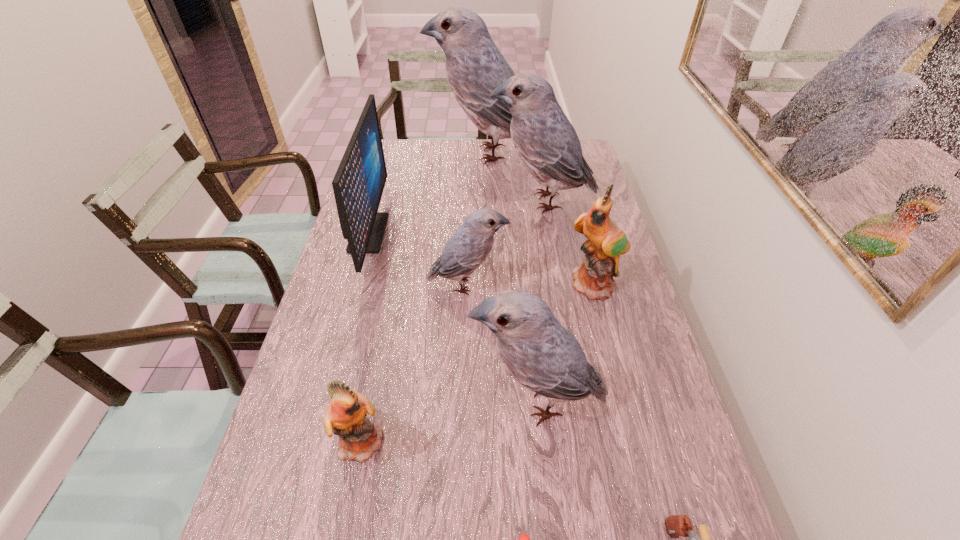
Identify which parrot is the sixth nearest to the leftmost object. Please provide its 2D coordinates. Your answer should be formatted as a tuple, i.e. [(x, y)], where the tuple contains the x and y coordinates of a point satisfying the conditions above.

[(606, 241)]

Locate which gray parrot is the fourth closest to the gun. Please provide its 2D coordinates. Your answer should be formatted as a tuple, i.e. [(x, y)], where the tuple contains the x and y coordinates of a point satisfying the conditions above.

[(474, 66)]

Locate an element on the screen. This screenshot has height=540, width=960. gray parrot identified as the third closest to the biggest gray parrot is located at coordinates (538, 352).

The width and height of the screenshot is (960, 540). What are the coordinates of `blank area in the image that satisfies the following two spatial constraints: 1. on the front-facing side of the farther green parrot; 2. on the front-facing side of the smaller green parrot` in the screenshot? It's located at (635, 440).

Where is `vacant space that satisfies the following two spatial constraints: 1. on the front-facing side of the farther green parrot; 2. on the front-facing side of the smaller green parrot`? vacant space that satisfies the following two spatial constraints: 1. on the front-facing side of the farther green parrot; 2. on the front-facing side of the smaller green parrot is located at coordinates (635, 440).